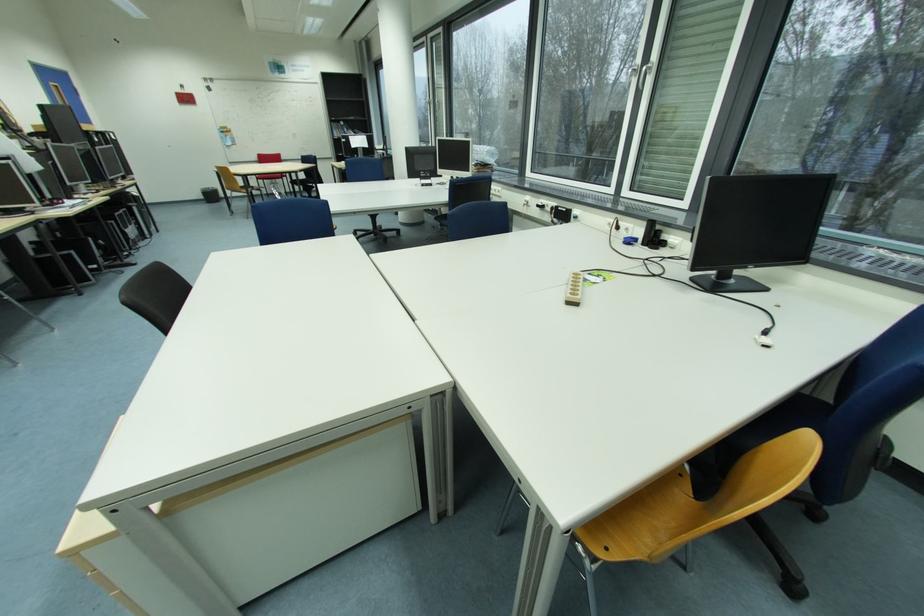
Find where to sit the blue chair sitting surface. Please return your answer as a coordinate pair (x, y).

(808, 415)